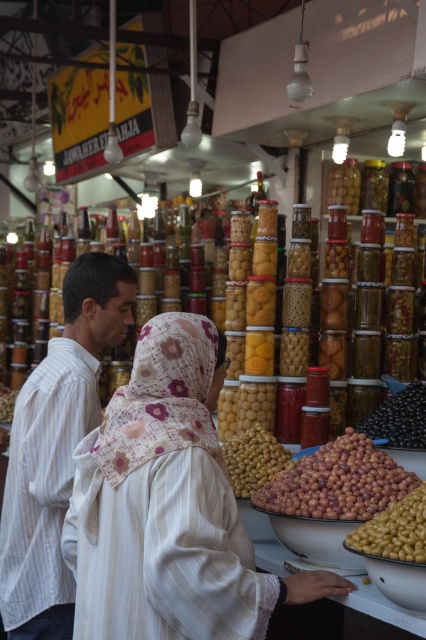
You are standing at the center of the market stall and notice a white striped shirt at left. Based on its coordinates, is the shirt positioned to your left or right side?

The white striped shirt at left is located at point 0.700 in the x coordinate, which places it to your left side since lower x values indicate positions to the left in this coordinate system.

You are a customer at the market stall and want to buy the taller jar of olives. Which one should you choose between the brown matte olives at center and the black glossy olives at center?

The black glossy olives at center is taller than the brown matte olives at center, so you should choose the black glossy olives at center.

You are a customer at the market stall and want to place an order for both the brown matte olives at center and the black glossy olives at center. You have a container that is 36 inches long. If you line them up end to end, will they fit in your container?

The distance between the brown matte olives at center and black glossy olives at center is 36.21 inches. Since your container is only 36 inches long, the combined length of the two items would exceed the container by 0.21 inches, so they will not fit.